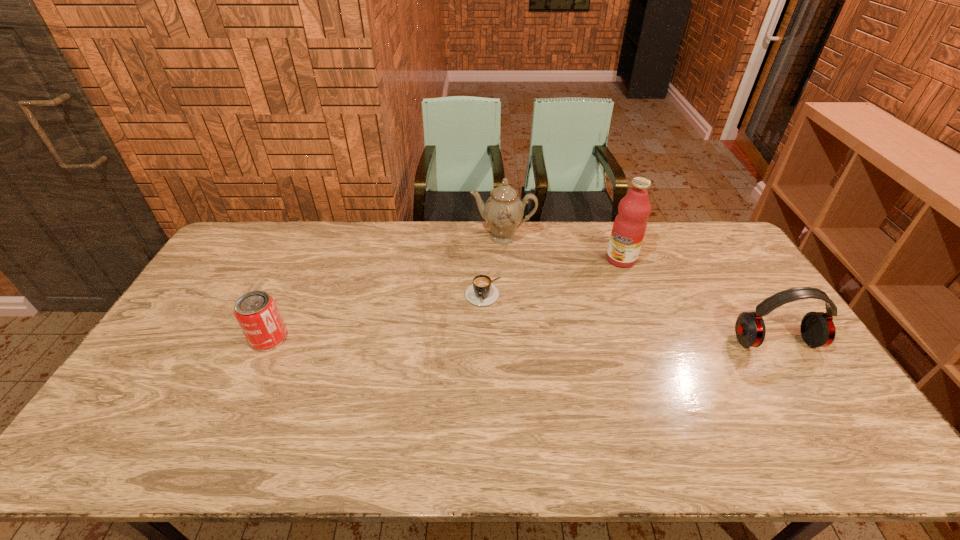
Identify the location of can. (256, 312).

Where is `the fourth tallest object`? the fourth tallest object is located at coordinates (256, 312).

Identify the location of earphone. (817, 329).

You are a GUI agent. You are given a task and a screenshot of the screen. Output one action in this format:
    pyautogui.click(x=<x>, y=<y>)
    Task: Click on the rightmost object
    
    Given the screenshot: What is the action you would take?
    pyautogui.click(x=817, y=329)

You are a GUI agent. You are given a task and a screenshot of the screen. Output one action in this format:
    pyautogui.click(x=<x>, y=<y>)
    Task: Click on the cappuccino
    Image resolution: width=960 pixels, height=540 pixels.
    Given the screenshot: What is the action you would take?
    pyautogui.click(x=481, y=292)

This screenshot has height=540, width=960. I want to click on the shortest object, so click(x=481, y=292).

This screenshot has height=540, width=960. What are the coordinates of `fruit juice` in the screenshot? It's located at (630, 224).

Where is `the second farthest object`? The height and width of the screenshot is (540, 960). the second farthest object is located at coordinates (630, 224).

Image resolution: width=960 pixels, height=540 pixels. What are the coordinates of `the farthest object` in the screenshot? It's located at (503, 211).

Where is `chinaware`? Image resolution: width=960 pixels, height=540 pixels. chinaware is located at coordinates (503, 211).